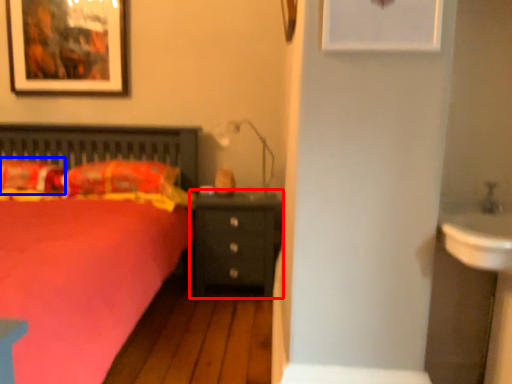
Question: Which object is closer to the camera taking this photo, nightstand (highlighted by a red box) or pillow (highlighted by a blue box)?

Choices:
 (A) nightstand
 (B) pillow

Answer: (B)